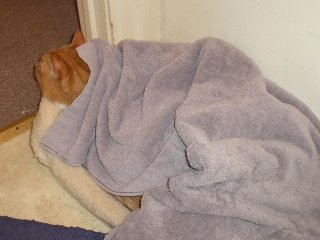
The image size is (320, 240). What are the coordinates of `dry wall` in the screenshot? It's located at (270, 19).